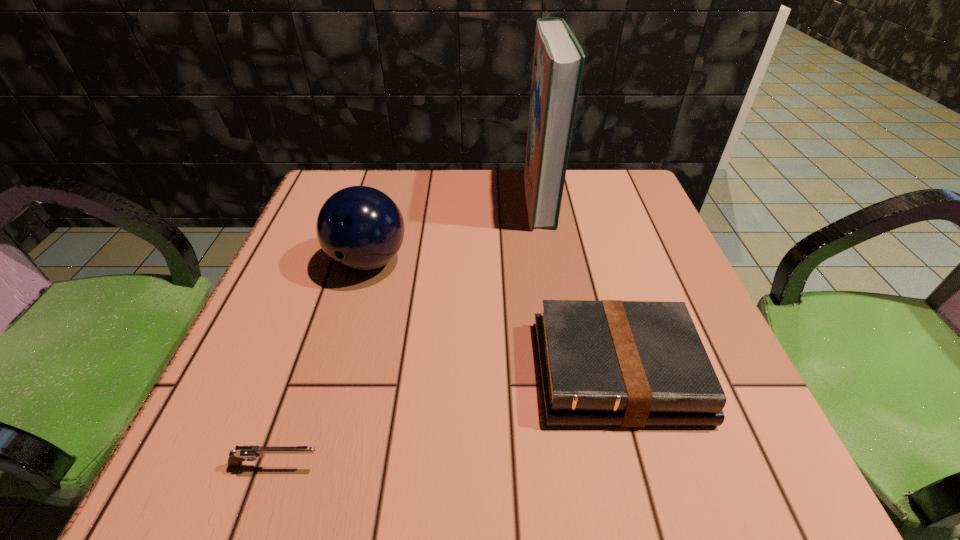
Locate an element on the screen. This screenshot has height=540, width=960. free space located 0.180m on the cover of the farthest object is located at coordinates (449, 198).

The width and height of the screenshot is (960, 540). Find the location of `vacant space located on the surface of the bowling ball near the finger holes`. vacant space located on the surface of the bowling ball near the finger holes is located at coordinates (311, 467).

This screenshot has height=540, width=960. In order to click on free point located on the spine side of the second nearest object in this screenshot , I will do `click(642, 466)`.

What are the coordinates of `blank space located on the front-facing side of the shortest object` in the screenshot? It's located at (398, 465).

Locate an element on the screen. The height and width of the screenshot is (540, 960). object that is at the far edge is located at coordinates (558, 62).

Image resolution: width=960 pixels, height=540 pixels. In order to click on hardback book that is positioned at the near edge in this screenshot , I will do `click(620, 363)`.

At what (x,y) coordinates should I click in order to perform the action: click on pistol that is positioned at the near edge. Please return your answer as a coordinate pair (x, y). Looking at the image, I should click on (246, 452).

The image size is (960, 540). In order to click on bowling ball that is at the left edge in this screenshot , I will do `click(360, 228)`.

Identify the location of pistol that is positioned at the left edge. (246, 452).

At what (x,y) coordinates should I click in order to perform the action: click on object present at the right edge. Please return your answer as a coordinate pair (x, y). Looking at the image, I should click on (620, 363).